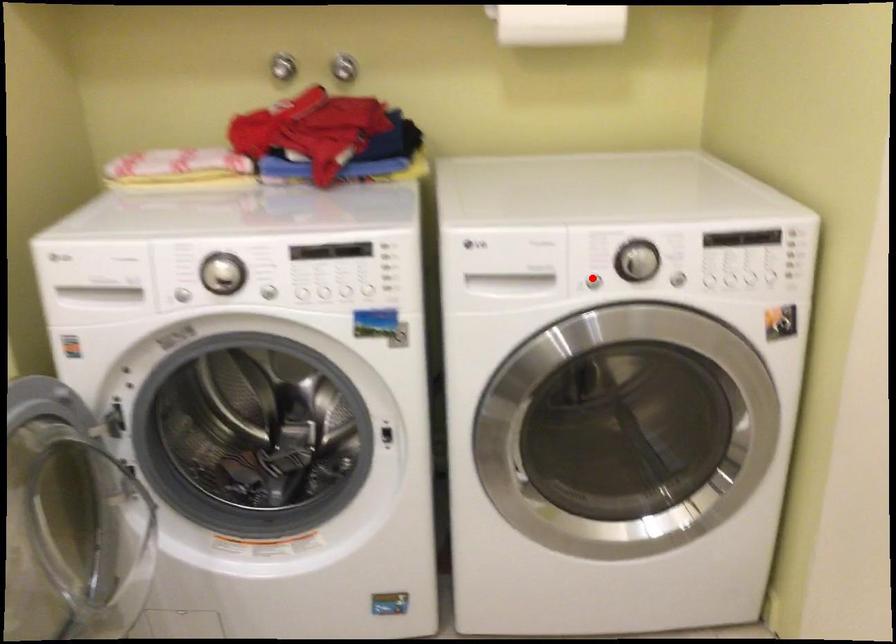
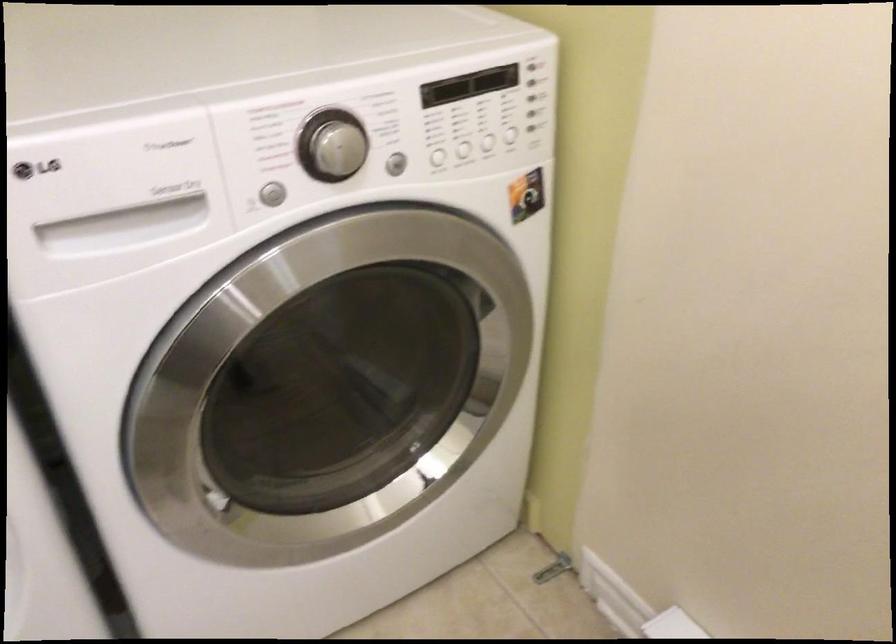
Question: A red point is marked in image1. In image2, is the corresponding 3D point closer to the camera or farther? Reply with the corresponding letter.

Choices:
 (A) The corresponding 3D point is closer.
 (B) The corresponding 3D point is farther.

Answer: (A)